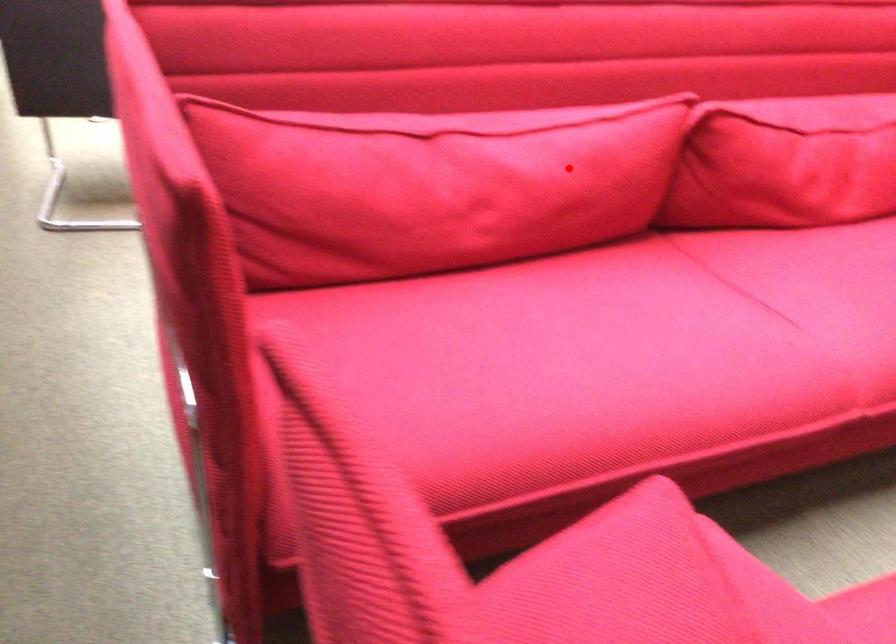
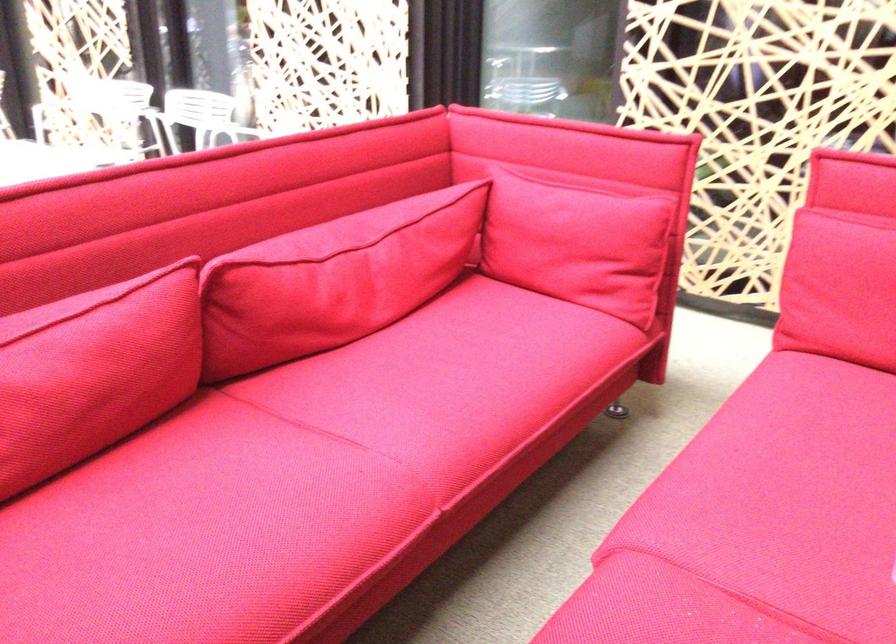
The point at the highlighted location is marked in the first image. Where is the corresponding point in the second image?

(93, 371)